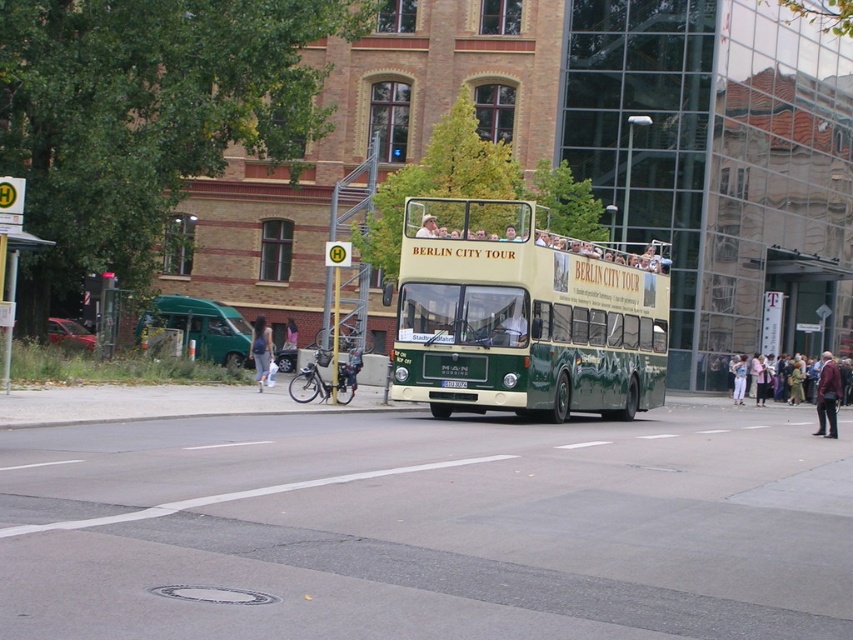
Question: Is the position of green matte double-decker bus at center less distant than that of denim jacket at center?

Choices:
 (A) yes
 (B) no

Answer: (A)

Question: Which is farther from the maroon leather jacket at lower right?

Choices:
 (A) denim jacket at center
 (B) denim pants at center
 (C) green matte double-decker bus at center

Answer: (A)

Question: Is green matte double-decker bus at center bigger than denim jacket at center?

Choices:
 (A) no
 (B) yes

Answer: (B)

Question: Is maroon leather jacket at lower right closer to camera compared to denim jacket at center?

Choices:
 (A) yes
 (B) no

Answer: (A)

Question: Which point appears farthest from the camera in this image?

Choices:
 (A) (265, 339)
 (B) (735, 365)
 (C) (836, 374)

Answer: (B)

Question: Which point appears closest to the camera in this image?

Choices:
 (A) (524, 268)
 (B) (819, 435)
 (C) (744, 387)
 (D) (265, 324)

Answer: (A)